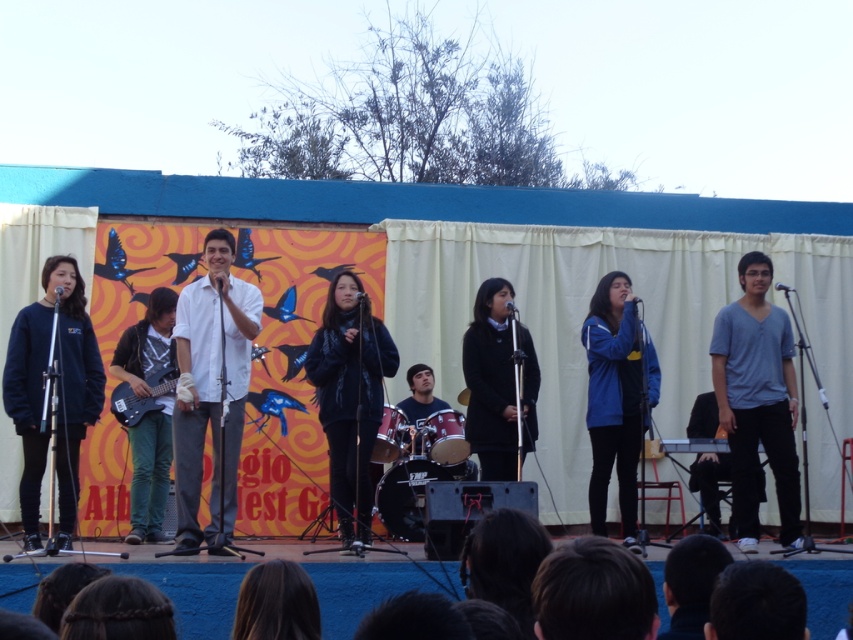
Question: Can you confirm if dark blue sweatshirt at left is bigger than black fuzzy sweater at center?

Choices:
 (A) yes
 (B) no

Answer: (B)

Question: In this image, where is black fuzzy sweater at center located relative to black matte guitar at center?

Choices:
 (A) left
 (B) right

Answer: (B)

Question: Considering the real-world distances, which object is closest to the matte black guitar at center?

Choices:
 (A) white matte shirt at center
 (B) blue fabric jacket at center
 (C) dark blue sweatshirt at left
 (D) black fuzzy sweater at center

Answer: (C)

Question: Is blue fabric jacket at center smaller than matte black guitar at center?

Choices:
 (A) yes
 (B) no

Answer: (B)

Question: Among these points, which one is nearest to the camera?

Choices:
 (A) (90, 381)
 (B) (310, 362)

Answer: (A)

Question: Which of these objects is positioned farthest from the blue fabric jacket at center?

Choices:
 (A) black fuzzy sweater at center
 (B) dark blue sweatshirt at left
 (C) matte black guitar at center

Answer: (B)